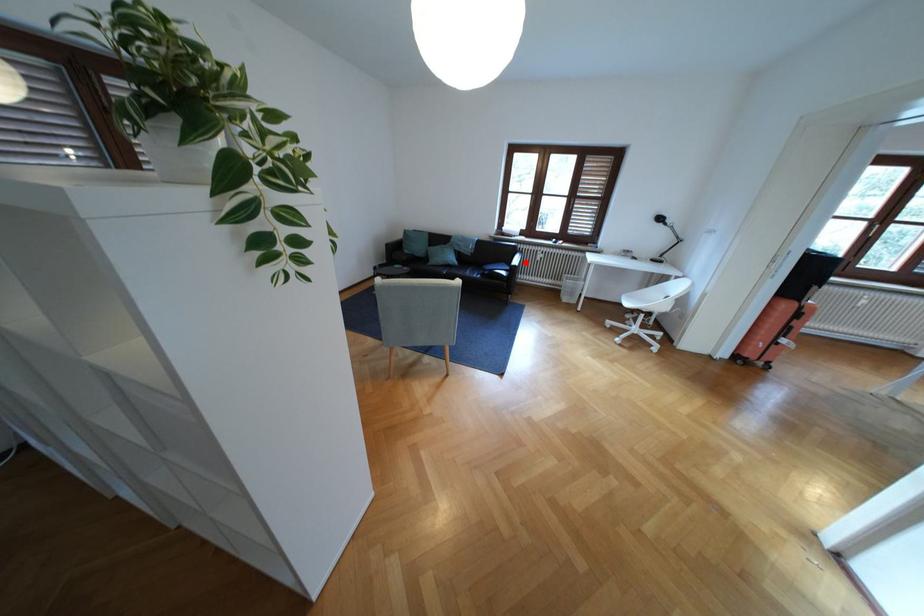
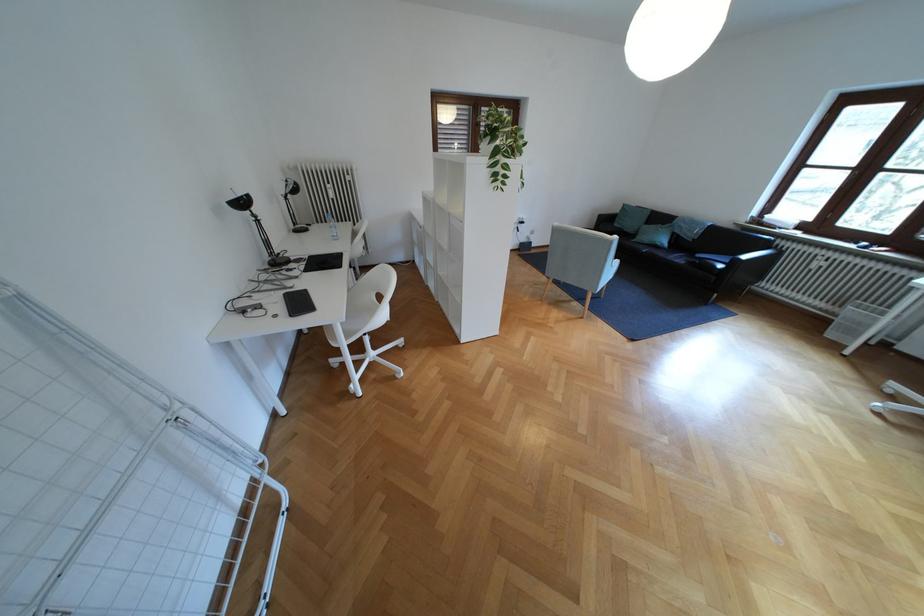
Question: A red point is marked in image1. In image2, is the corresponding 3D point closer to the camera or farther? Reply with the corresponding letter.

Choices:
 (A) The corresponding 3D point is closer.
 (B) The corresponding 3D point is farther.

Answer: (B)